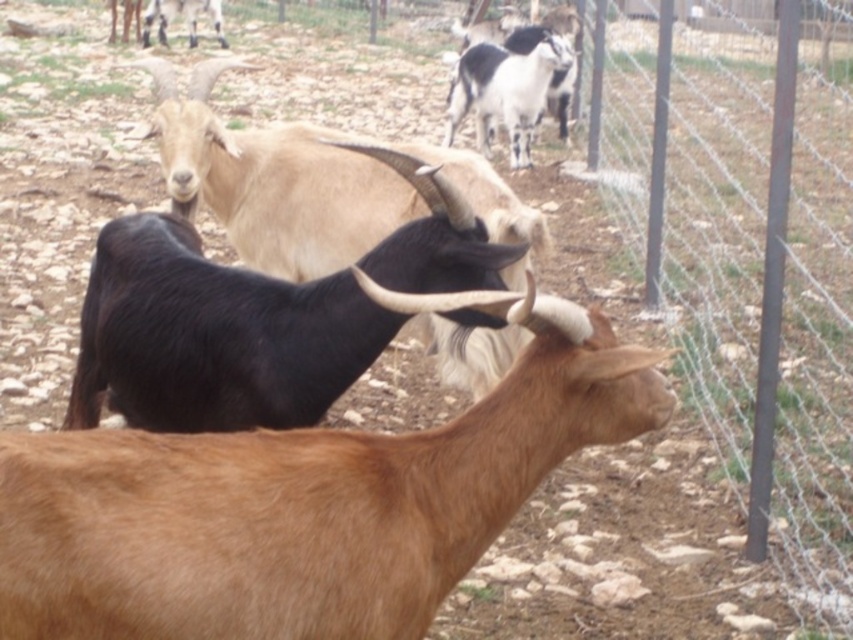
Which of these two, black woolen goat at center or light brown woolen goat at upper center, stands taller?

Standing taller between the two is black woolen goat at center.

Does point (207, 173) come closer to viewer compared to point (210, 8)?

Yes, point (207, 173) is closer to viewer.

Identify the location of black woolen goat at center. The image size is (853, 640). point(308,182).

Between point (350, 460) and point (187, 0), which one is positioned in front?

Point (350, 460) is in front.

Does black matte/goat at center appear on the right side of light brown woolen goat at upper center?

Indeed, black matte/goat at center is positioned on the right side of light brown woolen goat at upper center.

Which is in front, point (100, 493) or point (195, 42)?

Point (100, 493) is more forward.

Locate an element on the screen. Image resolution: width=853 pixels, height=640 pixels. black matte/goat at center is located at coordinates (306, 499).

Where is `black matte/goat at center`? Image resolution: width=853 pixels, height=640 pixels. black matte/goat at center is located at coordinates (306, 499).

Who is more forward, (x=158, y=445) or (x=526, y=221)?

Positioned in front is point (x=158, y=445).

Is point (177, 589) farther from camera compared to point (466, 172)?

No, it is in front of (466, 172).

Identify the location of black matte/goat at center. This screenshot has width=853, height=640. (306, 499).